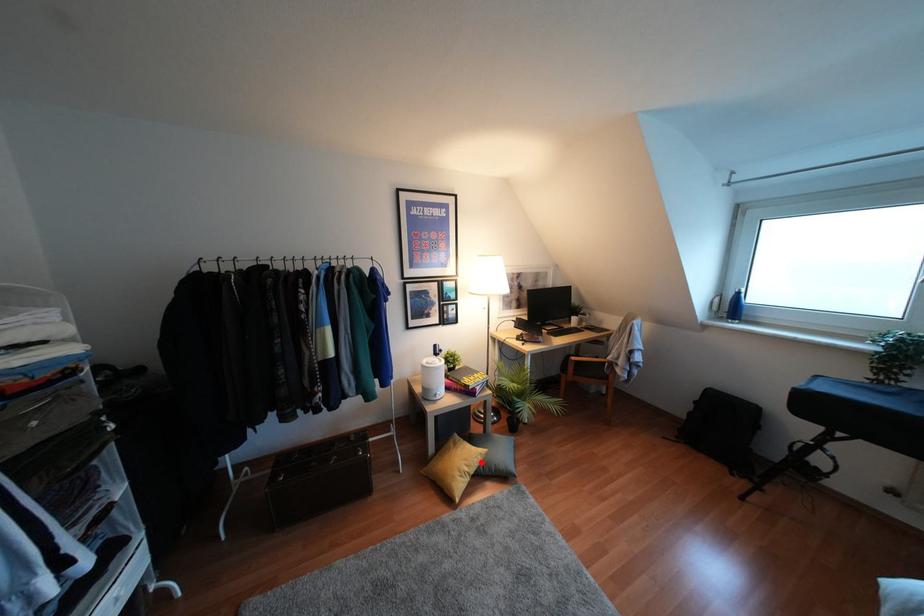
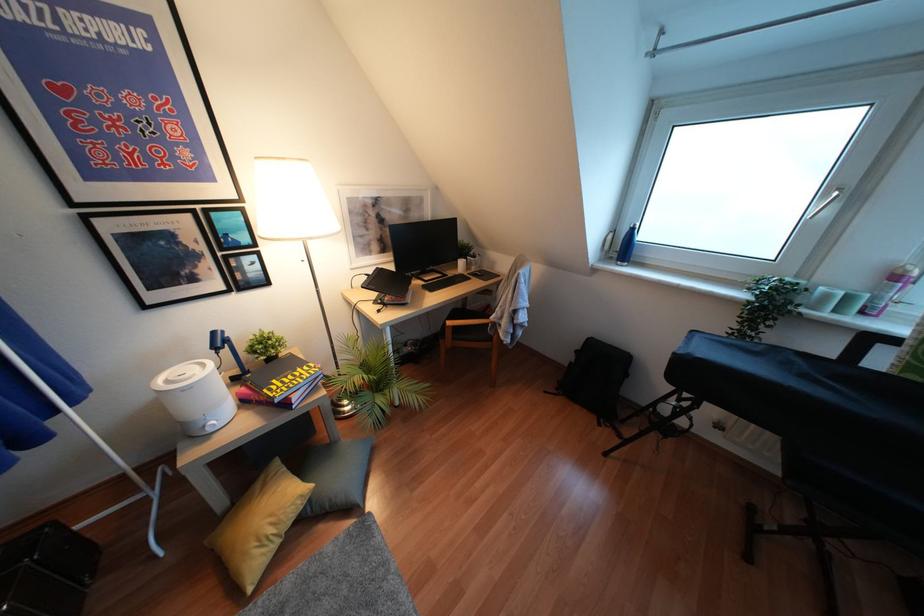
In the second image, find the point that corresponds to the highlighted location in the first image.

(310, 500)